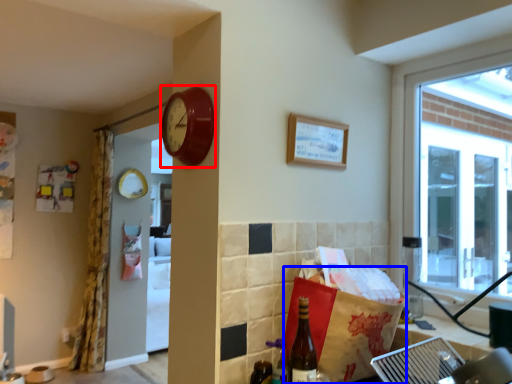
Question: Which of the following is the farthest to the observer, clock (highlighted by a red box) or shopping bag (highlighted by a blue box)?

Choices:
 (A) clock
 (B) shopping bag

Answer: (A)